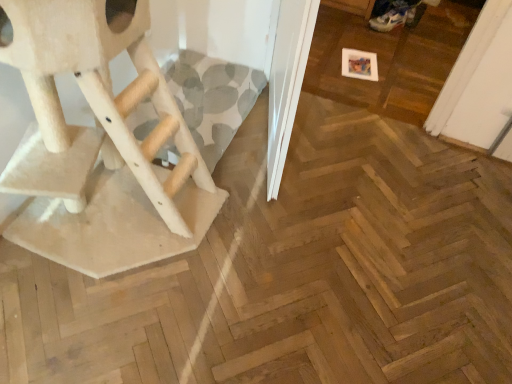
Find the location of `vacant area that is in front of beige carpeted cat tree at left`. vacant area that is in front of beige carpeted cat tree at left is located at coordinates (93, 324).